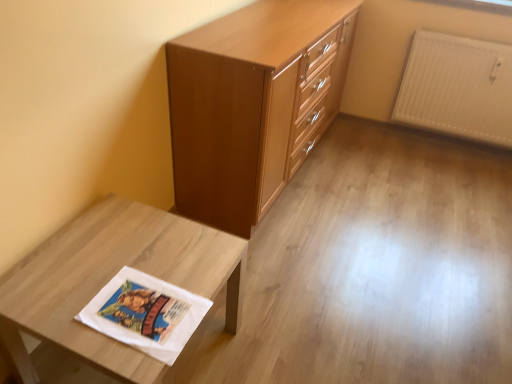
Where is `free point below white textured radiator at upper right (from a real-world perspective)`? free point below white textured radiator at upper right (from a real-world perspective) is located at coordinates (449, 145).